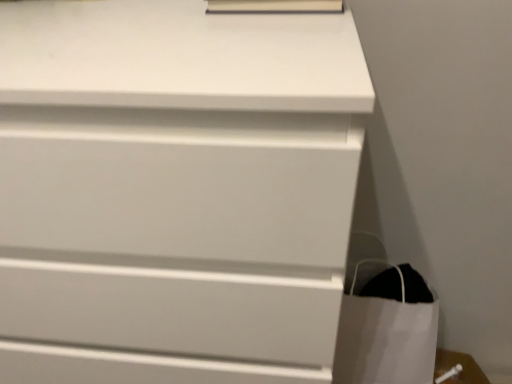
The width and height of the screenshot is (512, 384). I want to click on vacant space situated above white matte chest of drawers at center (from a real-world perspective), so click(125, 25).